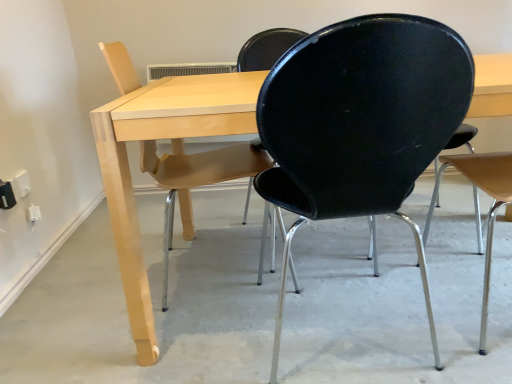
Question: Based on their sizes in the image, would you say light wood table at center is bigger or smaller than black matte chair at right, acting as the 3th chair starting from the left?

Choices:
 (A) big
 (B) small

Answer: (A)

Question: Considering their positions, is light wood table at center located in front of or behind black matte chair at right, positioned as the first chair in right-to-left order?

Choices:
 (A) front
 (B) behind

Answer: (B)

Question: Considering the real-world distances, which object is closest to the white plastic electric outlet at lower left?

Choices:
 (A) black matte chair at right, positioned as the first chair in right-to-left order
 (B) black plastic chair at center, arranged as the second chair when viewed from the right
 (C) matte wood chair at left, the 3th chair positioned from the right
 (D) smooth concrete floor at center
 (E) light wood table at center

Answer: (C)

Question: Which object is the farthest from the smooth concrete floor at center?

Choices:
 (A) white plastic electric outlet at lower left
 (B) light wood table at center
 (C) matte wood chair at left, which appears as the first chair when viewed from the left
 (D) black plastic chair at center, which ranks as the second chair in left-to-right order
 (E) black matte chair at right, acting as the 3th chair starting from the left

Answer: (A)